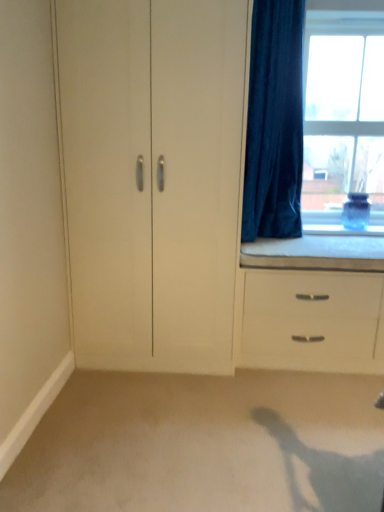
Describe the element at coordinates (343, 114) in the screenshot. I see `clear glass window at upper right` at that location.

The height and width of the screenshot is (512, 384). What are the coordinates of `velvet dark blue curtain at right` in the screenshot? It's located at (274, 122).

What is the approximate width of white matte chest of drawers at lower right?

white matte chest of drawers at lower right is 22.42 inches in width.

Find the location of `white matte chest of drawers at lower right`. white matte chest of drawers at lower right is located at coordinates 312,321.

The width and height of the screenshot is (384, 512). What do you see at coordinates (152, 178) in the screenshot?
I see `white matte cabinet at center` at bounding box center [152, 178].

In order to face white foam cushion at window, should I rotate leftwards or rightwards?

You should look right and rotate roughly 16.773 degrees.

Describe the element at coordinates (204, 444) in the screenshot. I see `beige carpet at lower center` at that location.

The image size is (384, 512). In order to click on clear glass window at upper right in this screenshot , I will do `click(343, 114)`.

In the image, is white matte cabinet at center positioned in front of or behind clear glass window at upper right?

white matte cabinet at center is in front of clear glass window at upper right.

Is white matte cabinet at center facing towards clear glass window at upper right?

No.

Find the location of a particular element. This screenshot has width=384, height=512. window on the right of white matte cabinet at center is located at coordinates (343, 114).

Considering the relative positions of white matte cabinet at center and clear glass window at upper right in the image provided, is white matte cabinet at center to the left or to the right of clear glass window at upper right?

white matte cabinet at center is positioned on clear glass window at upper right's left side.

From the image's perspective, is white foam cushion at window below clear glass window at upper right?

Yes.

In the scene shown: How many degrees apart are the facing directions of white foam cushion at window and clear glass window at upper right?

The angle between the facing direction of white foam cushion at window and the facing direction of clear glass window at upper right is 0.214 degrees.

Is white foam cushion at window further to the viewer compared to clear glass window at upper right?

No, white foam cushion at window is in front of clear glass window at upper right.

Which of these two, clear glass window at upper right or beige carpet at lower center, is thinner?

With smaller width is clear glass window at upper right.

Based on their positions, is clear glass window at upper right located to the left or right of beige carpet at lower center?

Clearly, clear glass window at upper right is on the right of beige carpet at lower center in the image.

I want to click on plain in front of the clear glass window at upper right, so click(x=204, y=444).

Is clear glass window at upper right facing away from beige carpet at lower center?

No, clear glass window at upper right's orientation is not away from beige carpet at lower center.

Can you confirm if white matte chest of drawers at lower right is shorter than velvet dark blue curtain at right?

Correct, white matte chest of drawers at lower right is not as tall as velvet dark blue curtain at right.

Is white matte chest of drawers at lower right looking in the opposite direction of velvet dark blue curtain at right?

white matte chest of drawers at lower right does not have its back to velvet dark blue curtain at right.

Is white matte chest of drawers at lower right positioned before velvet dark blue curtain at right?

No, the depth of white matte chest of drawers at lower right is greater than that of velvet dark blue curtain at right.

Image resolution: width=384 pixels, height=512 pixels. Identify the location of counter top on the left of the clear glass window at upper right. coord(316,252).

Consider the image. Does clear glass window at upper right have a lesser height compared to white foam cushion at window?

No, clear glass window at upper right is not shorter than white foam cushion at window.

From the image's perspective, relative to white foam cushion at window, is clear glass window at upper right above or below?

clear glass window at upper right is above white foam cushion at window.

Which is closer to the camera, [372,33] or [343,253]?

The point [343,253] is closer.

Is velvet dark blue curtain at right inside the boundaries of white matte chest of drawers at lower right, or outside?

The correct answer is: outside.

From the image's perspective, is velvet dark blue curtain at right above white matte chest of drawers at lower right?

Correct, velvet dark blue curtain at right appears higher than white matte chest of drawers at lower right in the image.

This screenshot has height=512, width=384. I want to click on chest of drawers on the right of velvet dark blue curtain at right, so click(x=312, y=321).

From a real-world perspective, which object stands above the other?

velvet dark blue curtain at right.

Is point (259, 165) behind point (342, 161)?

No.

Based on the photo, is velvet dark blue curtain at right positioned with its back to clear glass window at upper right?

No, velvet dark blue curtain at right is not facing away from clear glass window at upper right.

Based on the photo, is velvet dark blue curtain at right not inside clear glass window at upper right?

velvet dark blue curtain at right is positioned outside clear glass window at upper right.

Is velvet dark blue curtain at right bigger than clear glass window at upper right?

Yes, velvet dark blue curtain at right is bigger than clear glass window at upper right.

The width and height of the screenshot is (384, 512). Identify the location of cupboard on the left of clear glass window at upper right. (152, 178).

Where is `window behind the white foam cushion at window`? This screenshot has height=512, width=384. window behind the white foam cushion at window is located at coordinates (343, 114).

In the scene shown: When comparing their distances from velvet dark blue curtain at right, does white matte cabinet at center or white foam cushion at window seem further?

Among the two, white matte cabinet at center is located further to velvet dark blue curtain at right.

When comparing their distances from beige carpet at lower center, does white matte cabinet at center or white matte chest of drawers at lower right seem closer?

white matte chest of drawers at lower right is closer to beige carpet at lower center.

Looking at the image, which one is located further to white matte cabinet at center, beige carpet at lower center or clear glass window at upper right?

clear glass window at upper right lies further to white matte cabinet at center than the other object.

Which object lies further to the anchor point velvet dark blue curtain at right, white matte chest of drawers at lower right or white matte cabinet at center?

white matte chest of drawers at lower right is further to velvet dark blue curtain at right.

Which object lies further to the anchor point white matte cabinet at center, white matte chest of drawers at lower right or velvet dark blue curtain at right?

Among the two, white matte chest of drawers at lower right is located further to white matte cabinet at center.

When comparing their distances from clear glass window at upper right, does white matte cabinet at center or white foam cushion at window seem closer?

white foam cushion at window.

Which object lies further to the anchor point white matte cabinet at center, clear glass window at upper right or velvet dark blue curtain at right?

clear glass window at upper right is further to white matte cabinet at center.

Looking at this image, looking at the image, which one is located closer to velvet dark blue curtain at right, white foam cushion at window or beige carpet at lower center?

white foam cushion at window lies closer to velvet dark blue curtain at right than the other object.

You are a GUI agent. You are given a task and a screenshot of the screen. Output one action in this format:
    pyautogui.click(x=<x>, y=<y>)
    Task: Click on the counter top between velvet dark blue curtain at right and beige carpet at lower center from top to bottom
    The image size is (384, 512).
    Given the screenshot: What is the action you would take?
    pyautogui.click(x=316, y=252)

The height and width of the screenshot is (512, 384). I want to click on counter top between velvet dark blue curtain at right and white matte chest of drawers at lower right vertically, so click(x=316, y=252).

The image size is (384, 512). In order to click on the chest of drawers that lies between clear glass window at upper right and beige carpet at lower center from top to bottom in this screenshot , I will do `click(312, 321)`.

Find the location of `counter top between clear glass window at upper right and white matte chest of drawers at lower right vertically`. counter top between clear glass window at upper right and white matte chest of drawers at lower right vertically is located at coordinates (316, 252).